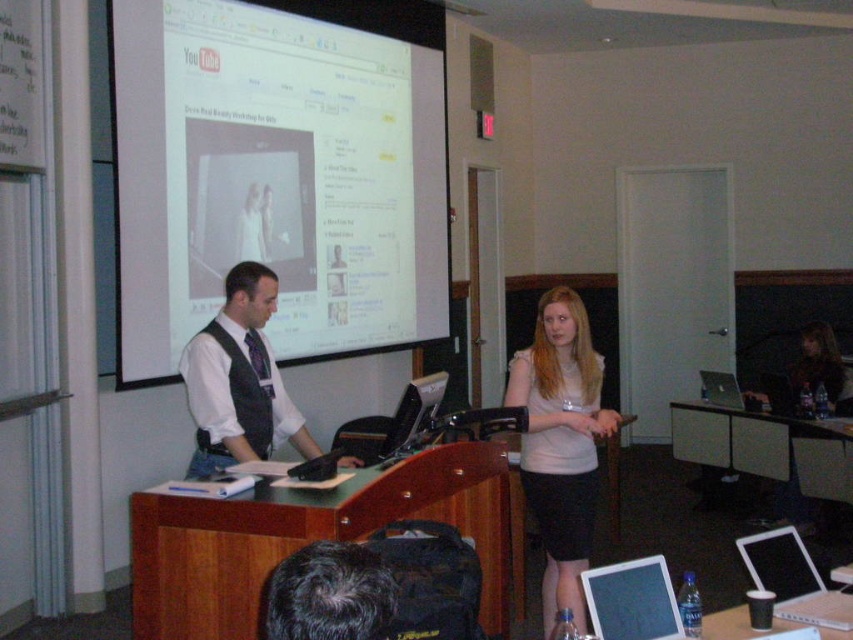
Is point (398, 211) in front of point (660, 616)?

That is False.

Who is shorter, white glossy projection screen at upper center or matte black tablet at lower center?

Standing shorter between the two is matte black tablet at lower center.

Is point (415, 13) in front of point (630, 609)?

No, (415, 13) is further to viewer.

The height and width of the screenshot is (640, 853). Find the location of `white glossy projection screen at upper center`. white glossy projection screen at upper center is located at coordinates (279, 172).

Can you confirm if white glossy projection screen at upper center is smaller than light pink fabric shirt at center?

Actually, white glossy projection screen at upper center might be larger than light pink fabric shirt at center.

Does white glossy projection screen at upper center appear on the right side of light pink fabric shirt at center?

In fact, white glossy projection screen at upper center is to the left of light pink fabric shirt at center.

In order to click on white glossy projection screen at upper center in this screenshot , I will do `click(279, 172)`.

Can you confirm if white glossy projection screen at upper center is smaller than silver metallic laptop at center?

Incorrect, white glossy projection screen at upper center is not smaller in size than silver metallic laptop at center.

Does white glossy projection screen at upper center come in front of silver metallic laptop at center?

Yes, it is in front of silver metallic laptop at center.

In order to click on white glossy projection screen at upper center in this screenshot , I will do `click(279, 172)`.

This screenshot has width=853, height=640. I want to click on white glossy projection screen at upper center, so click(279, 172).